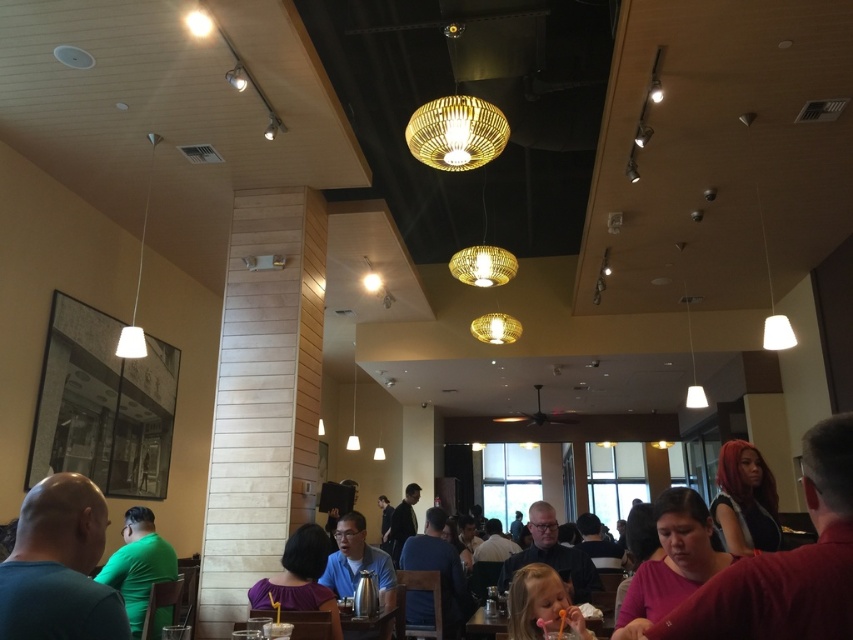
Can you confirm if pink matte shirt at lower right is bigger than shiny red hair at lower right?

Indeed, pink matte shirt at lower right has a larger size compared to shiny red hair at lower right.

Between pink matte shirt at lower right and shiny red hair at lower right, which one is positioned higher?

pink matte shirt at lower right is above.

Between point (834, 508) and point (738, 448), which one is positioned behind?

The point (738, 448) is more distant.

Locate an element on the screen. This screenshot has height=640, width=853. pink matte shirt at lower right is located at coordinates (782, 566).

The width and height of the screenshot is (853, 640). In order to click on matte pink shirt at lower right in this screenshot , I will do `click(671, 563)`.

Is matte pink shirt at lower right below woven wood chandelier at upper center?

Indeed, matte pink shirt at lower right is positioned under woven wood chandelier at upper center.

Is point (642, 604) positioned after point (434, 147)?

That is False.

Image resolution: width=853 pixels, height=640 pixels. Identify the location of matte pink shirt at lower right. (671, 563).

Is woven wood chandelier at upper center smaller than smooth pink spoon at lower center?

Incorrect, woven wood chandelier at upper center is not smaller in size than smooth pink spoon at lower center.

Is woven wood chandelier at upper center wider than smooth pink spoon at lower center?

Indeed, woven wood chandelier at upper center has a greater width compared to smooth pink spoon at lower center.

Does point (434, 156) come in front of point (508, 627)?

No, (434, 156) is further to viewer.

Locate an element on the screen. This screenshot has width=853, height=640. woven wood chandelier at upper center is located at coordinates (456, 132).